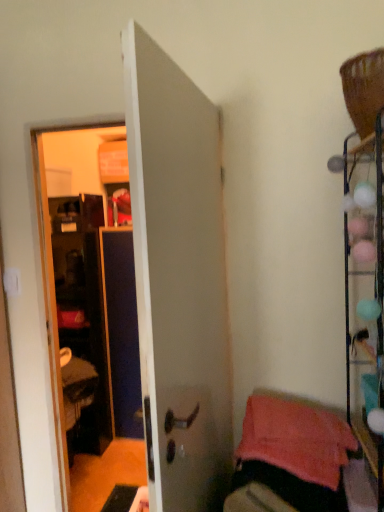
In order to face pink soft towel at lower right, should I rotate leftwards or rightwards?

Turn right approximately 13.652 degrees to face it.

Locate an element on the screen. The image size is (384, 512). pink soft towel at lower right is located at coordinates (298, 455).

Can you tell me how much white matte door at center and pink soft towel at lower right differ in facing direction?

There is a 85.7-degree angle between the facing directions of white matte door at center and pink soft towel at lower right.

Between white matte door at center and pink soft towel at lower right, which one has larger size?

With larger size is white matte door at center.

Which object is closer to the camera, white matte door at center or pink soft towel at lower right?

white matte door at center is in front.

From the image's perspective, which one is positioned lower, white matte door at center or pink soft towel at lower right?

pink soft towel at lower right is shown below in the image.

Looking at the image, does pink soft towel at lower right seem bigger or smaller compared to metallic wire rack at right?

pink soft towel at lower right is smaller than metallic wire rack at right.

Between point (306, 404) and point (381, 510), which one is positioned in front?

Point (381, 510)

From the image's perspective, between pink soft towel at lower right and metallic wire rack at right, which one is located above?

From the image's view, metallic wire rack at right is above.

Looking at this image, which of these two, pink soft towel at lower right or metallic wire rack at right, is wider?

pink soft towel at lower right.

Which of these two, white matte door at center or metallic wire rack at right, is thinner?

white matte door at center.

Is white matte door at center outside of metallic wire rack at right?

That's correct, white matte door at center is outside of metallic wire rack at right.

Is white matte door at center next to metallic wire rack at right?

No, white matte door at center is not making contact with metallic wire rack at right.

I want to click on shelf in front of the pink soft towel at lower right, so click(365, 304).

Who is taller, metallic wire rack at right or pink soft towel at lower right?

With more height is metallic wire rack at right.

Considering the sizes of metallic wire rack at right and pink soft towel at lower right in the image, is metallic wire rack at right bigger or smaller than pink soft towel at lower right?

metallic wire rack at right is bigger than pink soft towel at lower right.

Measure the distance from metallic wire rack at right to pink soft towel at lower right.

They are 10.89 inches apart.

From a real-world perspective, is pink soft towel at lower right positioned under white matte door at center based on gravity?

Indeed, from a real-world perspective, pink soft towel at lower right is positioned beneath white matte door at center.

Can white matte door at center be found inside pink soft towel at lower right?

No, white matte door at center is not inside pink soft towel at lower right.

Is pink soft towel at lower right positioned far away from white matte door at center?

That's not correct — pink soft towel at lower right is a little close to white matte door at center.

Which is more distant, [373,493] or [152,345]?

The point [373,493] is farther from the camera.

From a real-world perspective, relative to white matte door at center, is metallic wire rack at right vertically above or below?

From a real-world perspective, metallic wire rack at right is physically above white matte door at center.

Based on the photo, between metallic wire rack at right and white matte door at center, which one is positioned in front?

white matte door at center is more forward.

From the image's perspective, which object appears higher, metallic wire rack at right or white matte door at center?

metallic wire rack at right, from the image's perspective.

Find the location of a particular element. The width and height of the screenshot is (384, 512). door on the left of pink soft towel at lower right is located at coordinates tap(178, 279).

You are a GUI agent. You are given a task and a screenshot of the screen. Output one action in this format:
    pyautogui.click(x=<x>, y=<y>)
    Task: Click on the shelf in front of the pink soft towel at lower right
    
    Given the screenshot: What is the action you would take?
    pyautogui.click(x=365, y=304)

When comparing their distances from white matte door at center, does pink soft towel at lower right or metallic wire rack at right seem further?

metallic wire rack at right is positioned further to the anchor white matte door at center.

Which object lies nearer to the anchor point metallic wire rack at right, white matte door at center or pink soft towel at lower right?

pink soft towel at lower right.

From the image, which object appears to be nearer to pink soft towel at lower right, metallic wire rack at right or white matte door at center?

metallic wire rack at right.

Considering their positions, is pink soft towel at lower right positioned closer to metallic wire rack at right than white matte door at center?

Among the two, pink soft towel at lower right is located nearer to metallic wire rack at right.

Estimate the real-world distances between objects in this image. Which object is closer to pink soft towel at lower right, white matte door at center or metallic wire rack at right?

Based on the image, metallic wire rack at right appears to be nearer to pink soft towel at lower right.

Looking at the image, which one is located further to white matte door at center, metallic wire rack at right or pink soft towel at lower right?

metallic wire rack at right is positioned further to the anchor white matte door at center.

Where is `door between metallic wire rack at right and pink soft towel at lower right in the up-down direction`? door between metallic wire rack at right and pink soft towel at lower right in the up-down direction is located at coordinates (178, 279).